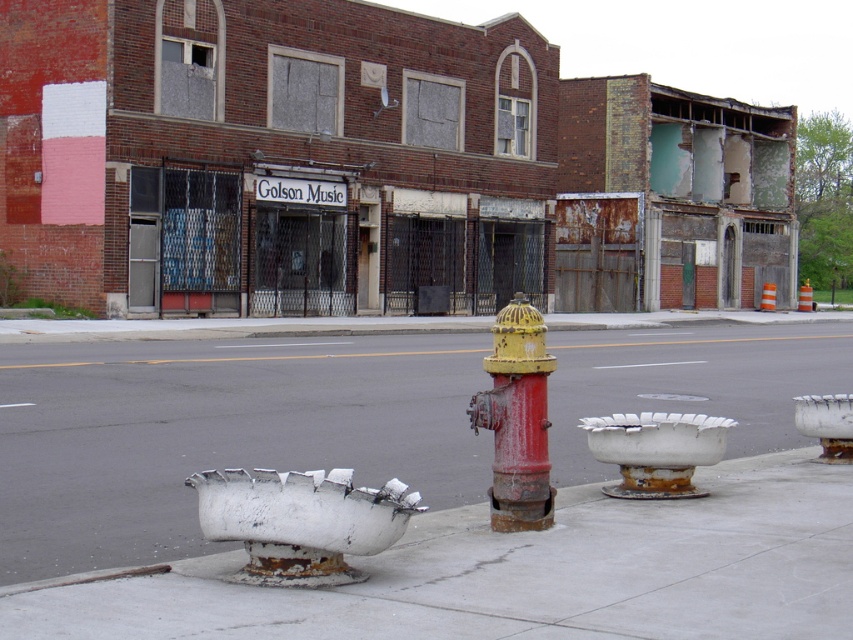
Question: Can you confirm if white rusted pavement at center is bigger than rusty metal fire hydrant at center?

Choices:
 (A) no
 (B) yes

Answer: (A)

Question: Which of the following is the closest to the observer?

Choices:
 (A) (718, 440)
 (B) (708, 576)

Answer: (B)

Question: Among these objects, which one is nearest to the camera?

Choices:
 (A) white concrete pavement at center
 (B) white rusted metal planter at lower left
 (C) white matte vent at center

Answer: (B)

Question: Considering the relative positions of white rusted pavement at center and white rusted metal planter at lower left in the image provided, where is white rusted pavement at center located with respect to white rusted metal planter at lower left?

Choices:
 (A) right
 (B) left

Answer: (A)

Question: Which object is the farthest from the white concrete pavement at center?

Choices:
 (A) white rusted metal planter at lower left
 (B) white matte vent at center
 (C) white rusted pavement at center
 (D) rusty metal fire hydrant at center

Answer: (C)

Question: Where is rusty metal fire hydrant at center located in relation to white matte vent at center in the image?

Choices:
 (A) left
 (B) right

Answer: (A)